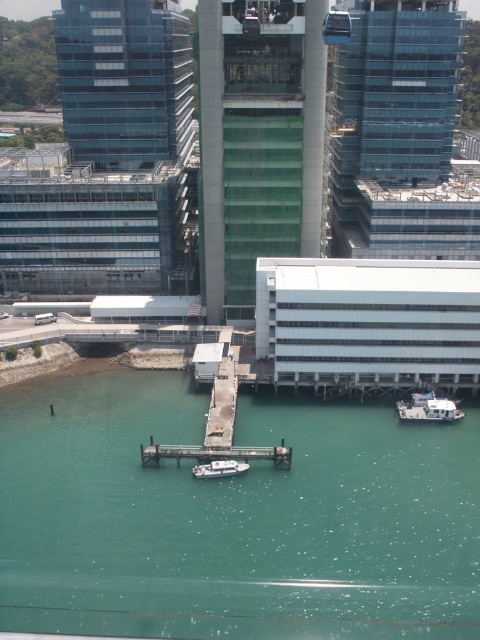
You are a tourist standing on the pier and want to take a photo of the white matte boat at lower right. To avoid including the green water at lower center in your photo, should you move to the left or right side of the pier?

The green water at lower center is positioned on the left side of white matte boat at lower right. To avoid including the green water at lower center, you should move to the right side of the pier.